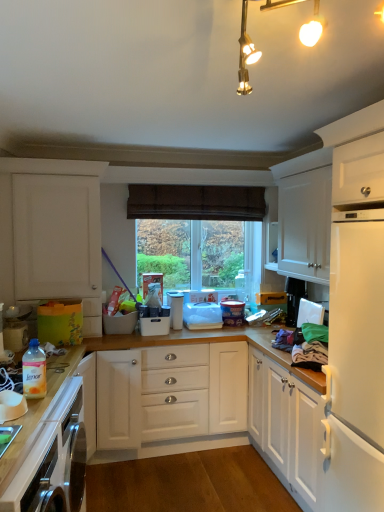
Question: Is white matte cabinet at left, marked as the 1th cabinetry in a left-to-right arrangement, located outside white plastic container at center, the second appliance in the back-to-front sequence?

Choices:
 (A) no
 (B) yes

Answer: (B)

Question: Would you say white plastic container at center, positioned as the 3th appliance in left-to-right order, is part of white matte cabinet at left, marked as the 1th cabinetry in a left-to-right arrangement,'s contents?

Choices:
 (A) yes
 (B) no

Answer: (B)

Question: Does white matte cabinet at left, which ranks as the second cabinetry in right-to-left order, have a lesser width compared to white plastic container at center, positioned as the 3th appliance in left-to-right order?

Choices:
 (A) no
 (B) yes

Answer: (A)

Question: Does white matte cabinet at left, marked as the 1th cabinetry in a left-to-right arrangement, lie behind white plastic container at center, the second appliance in the back-to-front sequence?

Choices:
 (A) yes
 (B) no

Answer: (B)

Question: From a real-world perspective, is white matte cabinet at left, marked as the 1th cabinetry in a left-to-right arrangement, beneath white plastic container at center, placed as the second appliance when sorted from right to left?

Choices:
 (A) yes
 (B) no

Answer: (B)

Question: Is translucent plastic fabric softener at lower left, which is the 1th appliance in front-to-back order, situated inside white plastic container at center, the 3th appliance positioned from the back, or outside?

Choices:
 (A) inside
 (B) outside

Answer: (B)

Question: In the image, is translucent plastic fabric softener at lower left, which is the 1th appliance in left-to-right order, positioned in front of or behind white plastic container at center, which is counted as the third appliance, starting from the right?

Choices:
 (A) behind
 (B) front

Answer: (B)

Question: Considering the positions of translucent plastic fabric softener at lower left, which is the 1th appliance in front-to-back order, and white plastic container at center, which is counted as the third appliance, starting from the right, in the image, is translucent plastic fabric softener at lower left, which is the 1th appliance in front-to-back order, wider or thinner than white plastic container at center, which is counted as the third appliance, starting from the right,?

Choices:
 (A) thin
 (B) wide

Answer: (A)

Question: Considering the positions of point (41, 382) and point (147, 306), is point (41, 382) closer or farther from the camera than point (147, 306)?

Choices:
 (A) farther
 (B) closer

Answer: (B)

Question: Visually, is transparent plastic window screen at center positioned to the left or to the right of wooden countertop at lower left?

Choices:
 (A) right
 (B) left

Answer: (A)

Question: Looking at their shapes, would you say transparent plastic window screen at center is wider or thinner than wooden countertop at lower left?

Choices:
 (A) wide
 (B) thin

Answer: (B)

Question: Choose the correct answer: Is transparent plastic window screen at center inside wooden countertop at lower left or outside it?

Choices:
 (A) outside
 (B) inside

Answer: (A)

Question: In terms of size, does transparent plastic window screen at center appear bigger or smaller than wooden countertop at lower left?

Choices:
 (A) small
 (B) big

Answer: (A)

Question: Is white plastic container at center, which is counted as the 4th appliance, starting from the left, wider or thinner than white matte cabinet at upper right, which is counted as the second cabinetry, starting from the left?

Choices:
 (A) wide
 (B) thin

Answer: (B)

Question: Does point (238, 316) appear closer or farther from the camera than point (319, 251)?

Choices:
 (A) closer
 (B) farther

Answer: (B)